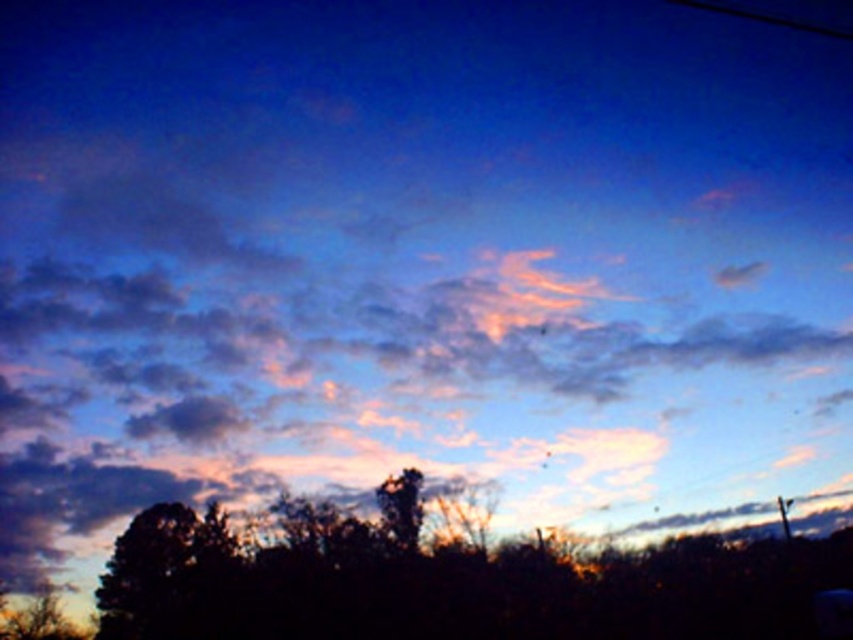
Question: Which object is the closest to the dark brown textured tree at center?

Choices:
 (A) smooth bark tree at center
 (B) dark green leafy tree at lower left

Answer: (B)

Question: Can you confirm if dark green leafy tree at lower left is positioned above smooth bark tree at center?

Choices:
 (A) yes
 (B) no

Answer: (B)

Question: Which point appears closest to the camera in this image?

Choices:
 (A) (415, 529)
 (B) (177, 604)
 (C) (714, 547)

Answer: (A)

Question: Which object is farther from the camera taking this photo?

Choices:
 (A) dark green leafy tree at lower left
 (B) smooth bark tree at center

Answer: (A)

Question: Does dark brown textured tree at center appear under dark green leafy tree at lower left?

Choices:
 (A) yes
 (B) no

Answer: (B)

Question: Observing the image, what is the correct spatial positioning of dark brown textured tree at center in reference to dark green leafy tree at lower left?

Choices:
 (A) right
 (B) left

Answer: (A)